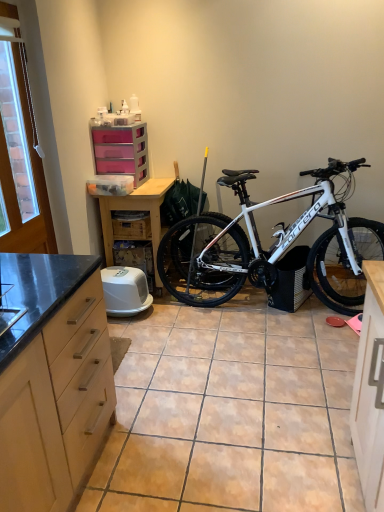
Locate an element on the screen. The image size is (384, 512). vacant region in front of white matte bicycle at center-right is located at coordinates (260, 375).